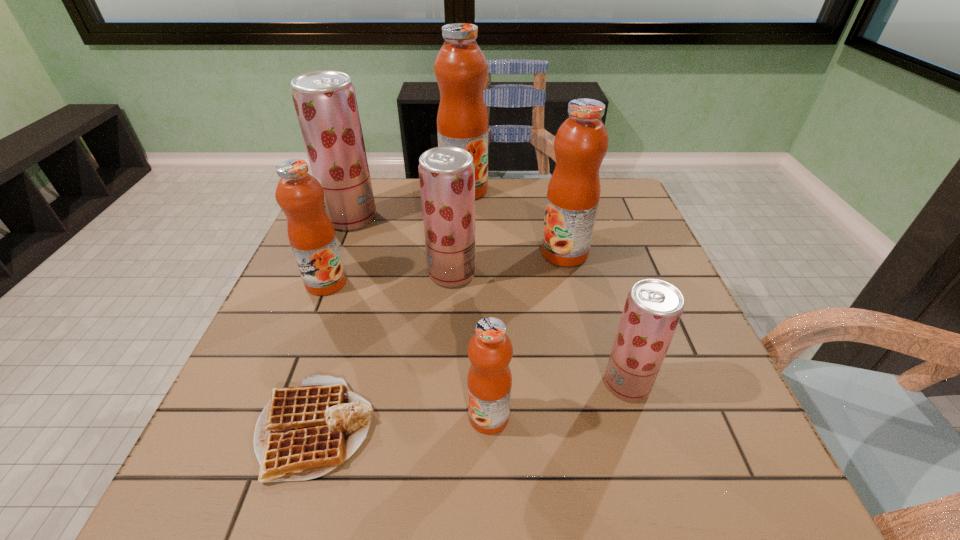
Identify the location of the farthest object. (x=460, y=67).

Where is `the farthest fruit juice`? the farthest fruit juice is located at coordinates (460, 67).

This screenshot has height=540, width=960. In order to click on the biggest strawberry fruit juice in this screenshot , I will do `click(325, 102)`.

Find the location of `the leftmost strawberry fruit juice`. the leftmost strawberry fruit juice is located at coordinates (325, 102).

This screenshot has height=540, width=960. In order to click on the second farthest orange fruit juice in this screenshot , I will do `click(581, 142)`.

Where is `the rightmost orange fruit juice`? The image size is (960, 540). the rightmost orange fruit juice is located at coordinates (581, 142).

In order to click on the second strawberry fruit juice from left to right in this screenshot , I will do `click(447, 174)`.

The height and width of the screenshot is (540, 960). Identify the location of the second nearest strawberry fruit juice. (447, 174).

The height and width of the screenshot is (540, 960). Find the location of `the leftmost orange fruit juice`. the leftmost orange fruit juice is located at coordinates (311, 234).

Where is `the second nearest orange fruit juice`? the second nearest orange fruit juice is located at coordinates (311, 234).